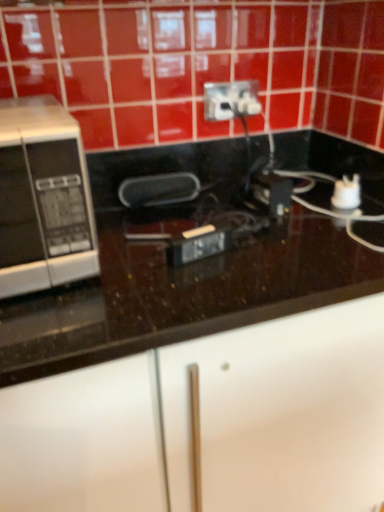
Question: From a real-world perspective, is white plastic power plugs and sockets at upper center positioned over silver/black microwave at left based on gravity?

Choices:
 (A) no
 (B) yes

Answer: (B)

Question: Is white plastic power plugs and sockets at upper center oriented away from silver/black microwave at left?

Choices:
 (A) no
 (B) yes

Answer: (A)

Question: Can you confirm if white plastic power plugs and sockets at upper center is positioned to the right of silver/black microwave at left?

Choices:
 (A) no
 (B) yes

Answer: (B)

Question: Considering the relative positions of white plastic power plugs and sockets at upper center and silver/black microwave at left in the image provided, is white plastic power plugs and sockets at upper center behind silver/black microwave at left?

Choices:
 (A) yes
 (B) no

Answer: (A)

Question: Is white plastic power plugs and sockets at upper center far from silver/black microwave at left?

Choices:
 (A) no
 (B) yes

Answer: (A)

Question: Choose the correct answer: Is white plastic power plugs and sockets at upper center inside black glossy countertop at center or outside it?

Choices:
 (A) outside
 (B) inside

Answer: (A)

Question: From a real-world perspective, is white plastic power plugs and sockets at upper center positioned above or below black glossy countertop at center?

Choices:
 (A) above
 (B) below

Answer: (A)

Question: Based on their sizes in the image, would you say white plastic power plugs and sockets at upper center is bigger or smaller than black glossy countertop at center?

Choices:
 (A) small
 (B) big

Answer: (A)

Question: Is white plastic power plugs and sockets at upper center to the left or to the right of black glossy countertop at center in the image?

Choices:
 (A) right
 (B) left

Answer: (A)

Question: From the image's perspective, is black glossy countertop at center above or below silver/black microwave at left?

Choices:
 (A) below
 (B) above

Answer: (A)

Question: Considering the positions of black glossy countertop at center and silver/black microwave at left in the image, is black glossy countertop at center wider or thinner than silver/black microwave at left?

Choices:
 (A) wide
 (B) thin

Answer: (A)

Question: Is black glossy countertop at center in front of or behind silver/black microwave at left in the image?

Choices:
 (A) behind
 (B) front

Answer: (B)

Question: Based on their sizes in the image, would you say black glossy countertop at center is bigger or smaller than silver/black microwave at left?

Choices:
 (A) small
 (B) big

Answer: (B)

Question: Considering the positions of white plastic power plugs and sockets at upper center and silver/black microwave at left in the image, is white plastic power plugs and sockets at upper center taller or shorter than silver/black microwave at left?

Choices:
 (A) tall
 (B) short

Answer: (B)

Question: Considering the positions of point (220, 89) and point (66, 201), is point (220, 89) closer or farther from the camera than point (66, 201)?

Choices:
 (A) closer
 (B) farther

Answer: (B)